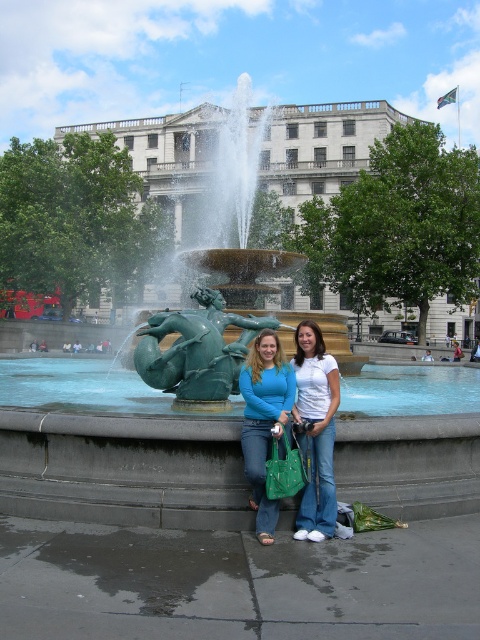
Question: Can you confirm if green patinated metal fountain at center is positioned below white cotton shirt at center?

Choices:
 (A) no
 (B) yes

Answer: (A)

Question: Which point is closer to the camera?

Choices:
 (A) green patinated bronze mermaid at center
 (B) matte blue shirt at center

Answer: (B)

Question: Is green patinated bronze mermaid at center to the right of white cotton shirt at center from the viewer's perspective?

Choices:
 (A) yes
 (B) no

Answer: (B)

Question: Considering the relative positions of green patinated bronze mermaid at center and matte blue shirt at center in the image provided, where is green patinated bronze mermaid at center located with respect to matte blue shirt at center?

Choices:
 (A) above
 (B) below

Answer: (A)

Question: Which of these objects is positioned farthest from the green patinated bronze mermaid at center?

Choices:
 (A) white cotton shirt at center
 (B) green patinated metal fountain at center
 (C) matte blue shirt at center

Answer: (A)

Question: Which of the following is the farthest from the observer?

Choices:
 (A) (273, 348)
 (B) (298, 342)
 (C) (110, 490)

Answer: (B)